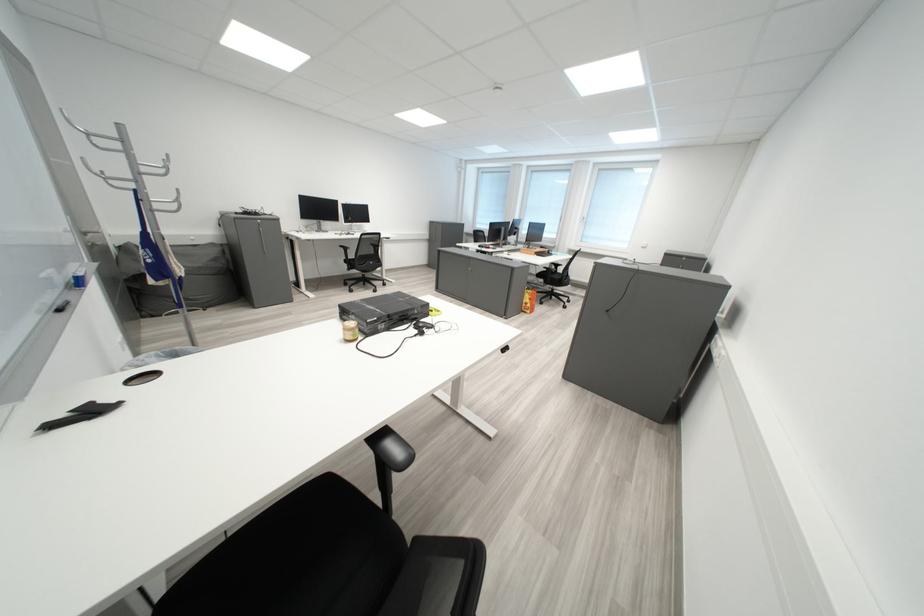
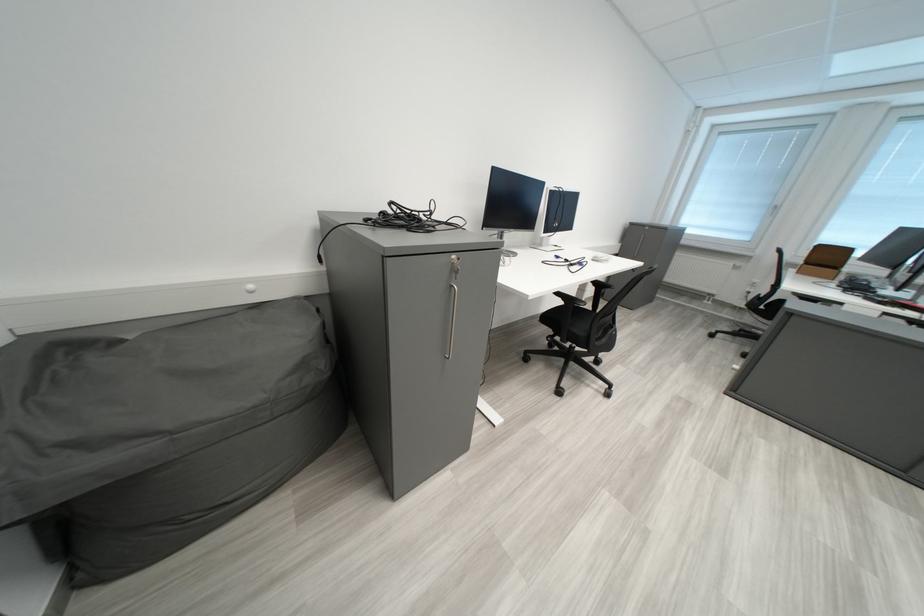
Which direction would the cameraman need to move to produce the second image?

The movement direction of the cameraman is left, forward.